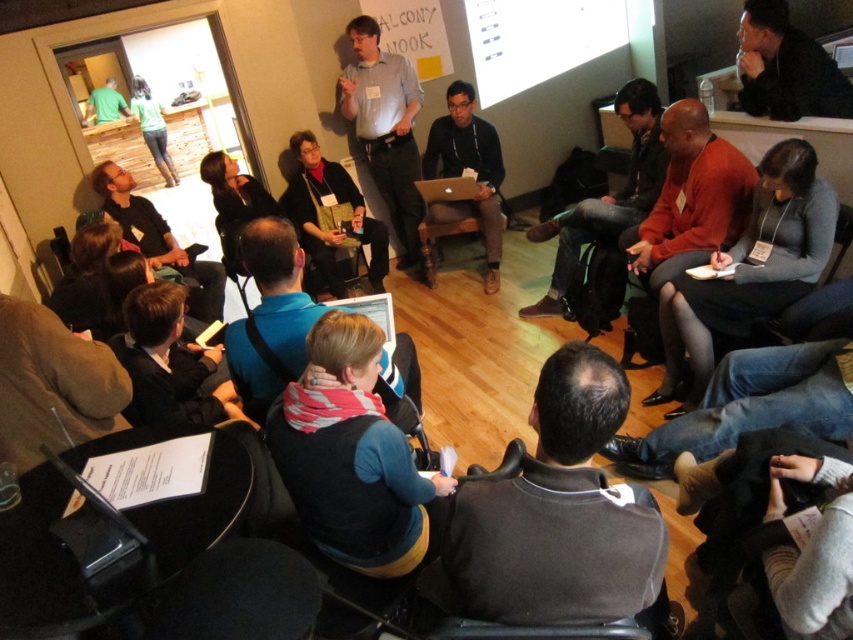
Who is higher up, light blue shirt at center or matte black laptop at center?

Positioned higher is light blue shirt at center.

Does light blue shirt at center appear over matte black laptop at center?

Indeed, light blue shirt at center is positioned over matte black laptop at center.

Is point (403, 212) closer to camera compared to point (469, 141)?

That is False.

I want to click on light blue shirt at center, so click(386, 128).

Is dark gray sweater at center taller than matte black laptop at center?

Incorrect, dark gray sweater at center's height is not larger of matte black laptop at center's.

At what (x,y) coordinates should I click in order to perform the action: click on dark gray sweater at center. Please return your answer as a coordinate pair (x, y). This screenshot has width=853, height=640. Looking at the image, I should click on (554, 516).

This screenshot has width=853, height=640. What do you see at coordinates (554, 516) in the screenshot? I see `dark gray sweater at center` at bounding box center [554, 516].

Locate an element on the screen. This screenshot has width=853, height=640. dark gray sweater at center is located at coordinates (554, 516).

Is dark gray sweater at center wider than light blue shirt at center?

Correct, the width of dark gray sweater at center exceeds that of light blue shirt at center.

The height and width of the screenshot is (640, 853). In order to click on dark gray sweater at center in this screenshot , I will do `click(554, 516)`.

Find the location of `dark gray sweater at center`. dark gray sweater at center is located at coordinates (554, 516).